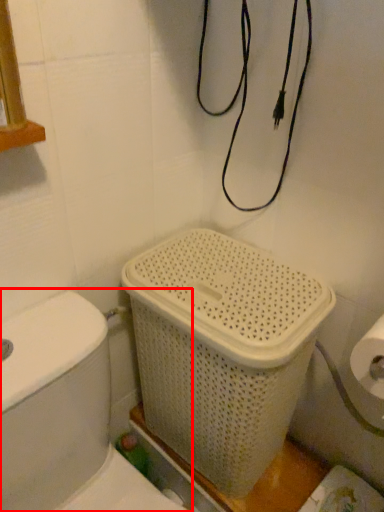
Question: In this image, where is toilet (annotated by the red box) located relative to basket container?

Choices:
 (A) right
 (B) left

Answer: (B)